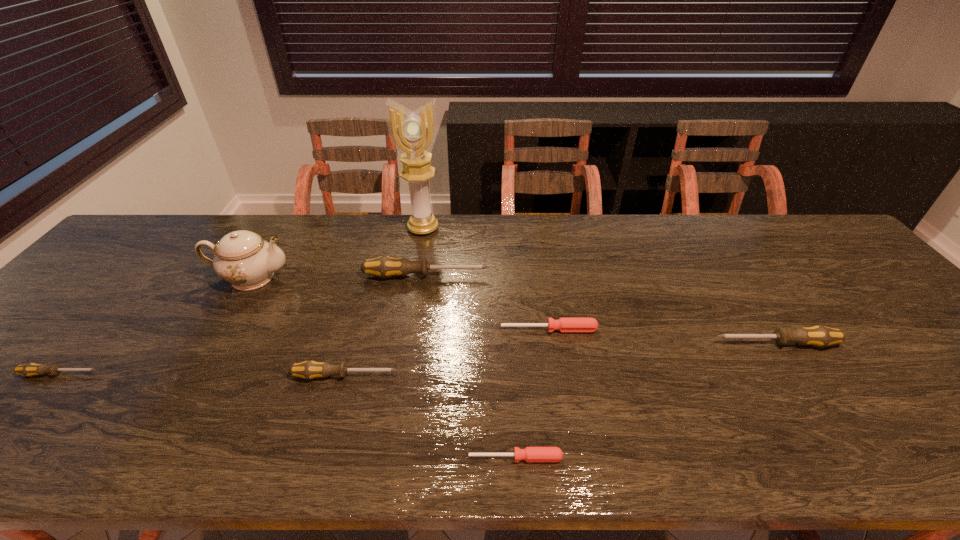
The image size is (960, 540). Find the location of `free space at the near edge of the desktop`. free space at the near edge of the desktop is located at coordinates (197, 450).

Locate an element on the screen. The height and width of the screenshot is (540, 960). vacant space at the right edge is located at coordinates (938, 360).

Identify the location of vacant region between the chinaware and the fourth farthest object. The width and height of the screenshot is (960, 540). (400, 303).

Locate an element on the screen. The image size is (960, 540). vacant point located between the leftmost screwdriver and the bigger red screwdriver is located at coordinates (304, 352).

Find the location of a particular element. vacant space that is in between the chinaware and the leftmost screwdriver is located at coordinates (156, 326).

This screenshot has height=540, width=960. In order to click on free space between the second object from left to right and the fifth tallest object in this screenshot , I will do point(299,327).

The image size is (960, 540). I want to click on vacant area that lies between the second tallest object and the third tallest screwdriver, so click(x=299, y=327).

Identify the location of free space between the farthest screwdriver and the leftmost object. This screenshot has height=540, width=960. (243, 325).

Where is `free spot between the chinaware and the tallest screwdriver`? free spot between the chinaware and the tallest screwdriver is located at coordinates (339, 276).

You are a GUI agent. You are given a task and a screenshot of the screen. Output one action in this format:
    pyautogui.click(x=<x>, y=<y>)
    Task: Click on the free space that is in between the shortest screwdriver and the farthest object
    This screenshot has height=540, width=960.
    Given the screenshot: What is the action you would take?
    coord(469,343)